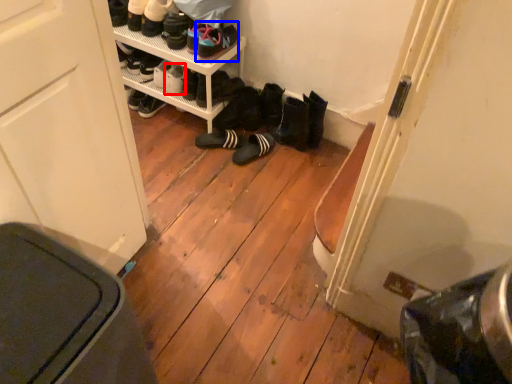
Question: Which object appears farthest to the camera in this image, footwear (highlighted by a red box) or footwear (highlighted by a blue box)?

Choices:
 (A) footwear
 (B) footwear

Answer: (A)